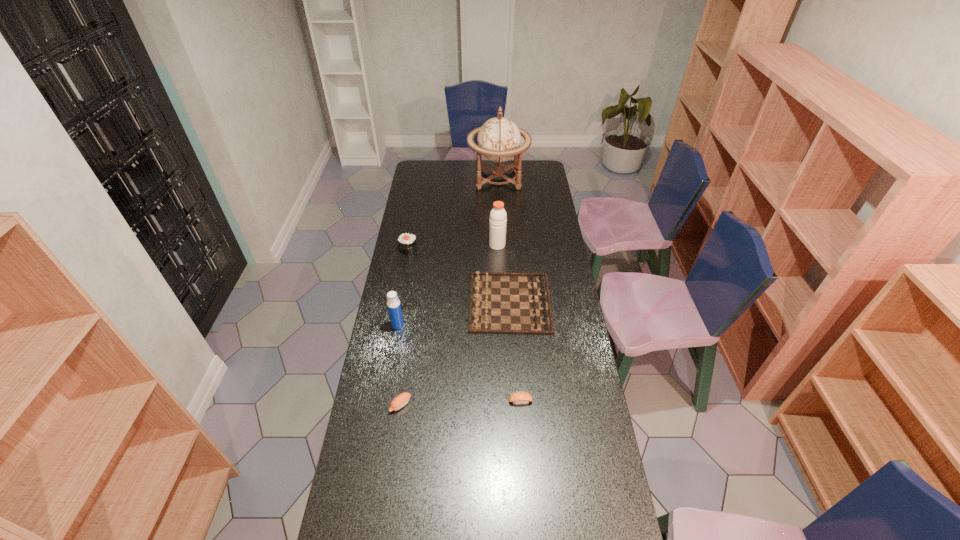
The width and height of the screenshot is (960, 540). In order to click on globe in this screenshot , I will do `click(498, 139)`.

Find the location of a particular element. This screenshot has height=540, width=960. the farthest object is located at coordinates (498, 139).

Identify the location of shaker. (498, 217).

You are a GUI agent. You are given a task and a screenshot of the screen. Output one action in this format:
    pyautogui.click(x=<x>, y=<y>)
    Task: Click on the water bottle
    
    Given the screenshot: What is the action you would take?
    393,303

The image size is (960, 540). In order to click on chessboard in this screenshot , I will do `click(500, 303)`.

This screenshot has height=540, width=960. I want to click on the tallest sushi, so click(x=407, y=242).

Find the location of `the second tallest sushi`. the second tallest sushi is located at coordinates (401, 400).

Find the location of a particular element. This screenshot has height=540, width=960. the shortest sushi is located at coordinates (521, 397).

Where is `the rightmost sushi`? the rightmost sushi is located at coordinates (521, 397).

In order to click on vacant space situated 0.130m at the front of the farthest object showing Africa in this screenshot , I will do `click(445, 178)`.